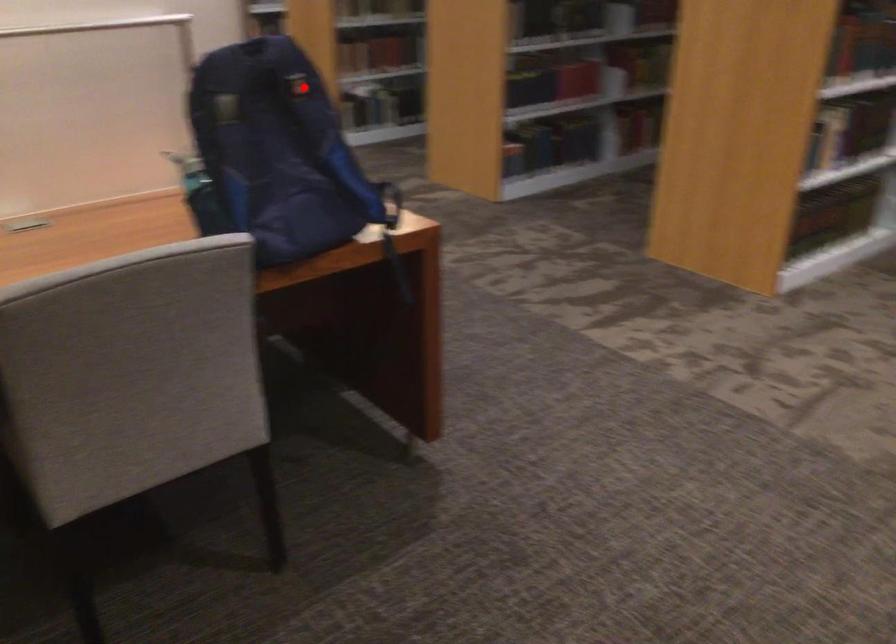
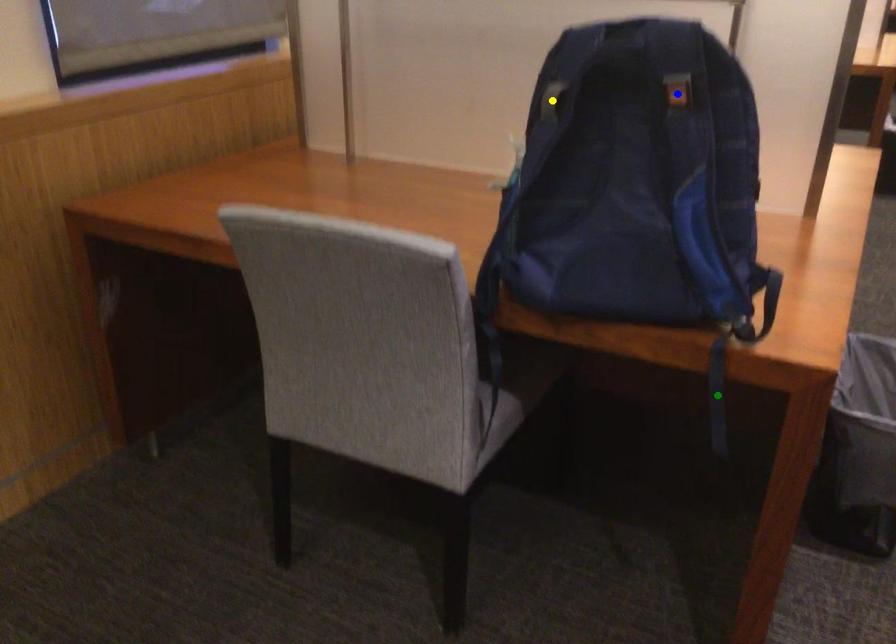
Question: I am providing you with two images of the same scene from different viewpoints. A red point is marked on the first image. You are given multiple points on the second image. Which point in image 2 is actually the same real-world point as the red point in image 1?

Choices:
 (A) blue point
 (B) yellow point
 (C) green point

Answer: (A)